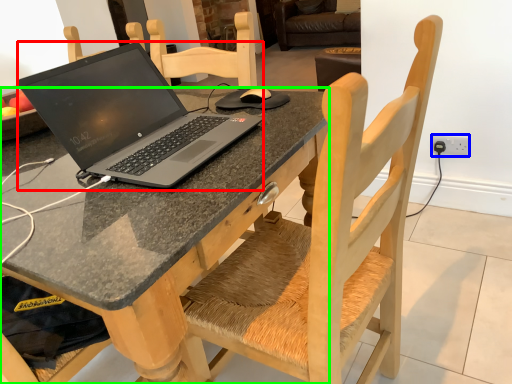
Question: Based on their relative distances, which object is farther from laptop (highlighted by a red box)? Choose from electric outlet (highlighted by a blue box) and desk (highlighted by a green box).

Choices:
 (A) electric outlet
 (B) desk

Answer: (A)